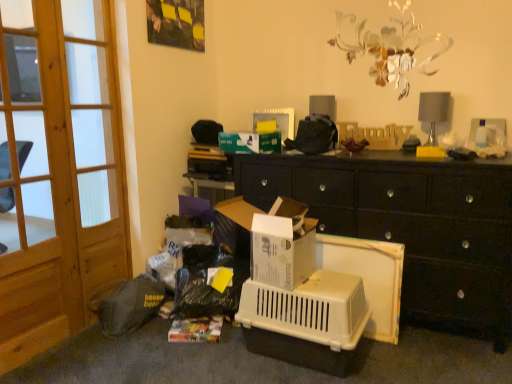
Question: Should I look upward or downward to see white plastic cabinet at center?

Choices:
 (A) down
 (B) up

Answer: (A)

Question: Considering the relative sizes of wooden screen door at left, which is the 1th screen door in left-to-right order, and wooden screen door at left, which is counted as the second screen door, starting from the left, in the image provided, is wooden screen door at left, which is the 1th screen door in left-to-right order, bigger than wooden screen door at left, which is counted as the second screen door, starting from the left,?

Choices:
 (A) yes
 (B) no

Answer: (A)

Question: Is wooden screen door at left, which ranks as the 2th screen door in right-to-left order, oriented away from wooden screen door at left, the first screen door positioned from the right?

Choices:
 (A) no
 (B) yes

Answer: (A)

Question: From the image's perspective, does wooden screen door at left, which ranks as the 2th screen door in right-to-left order, appear lower than wooden screen door at left, the first screen door positioned from the right?

Choices:
 (A) yes
 (B) no

Answer: (A)

Question: Is wooden screen door at left, which ranks as the 2th screen door in right-to-left order, at the right side of wooden screen door at left, which is counted as the second screen door, starting from the left?

Choices:
 (A) yes
 (B) no

Answer: (B)

Question: Does wooden screen door at left, which is the 1th screen door in left-to-right order, have a lesser width compared to wooden screen door at left, the first screen door positioned from the right?

Choices:
 (A) yes
 (B) no

Answer: (B)

Question: Considering the relative sizes of wooden screen door at left, which ranks as the 2th screen door in right-to-left order, and wooden screen door at left, which is counted as the second screen door, starting from the left, in the image provided, is wooden screen door at left, which ranks as the 2th screen door in right-to-left order, smaller than wooden screen door at left, which is counted as the second screen door, starting from the left,?

Choices:
 (A) yes
 (B) no

Answer: (B)

Question: Does white plastic cabinet at center appear on the right side of white cardboard box at center?

Choices:
 (A) no
 (B) yes

Answer: (B)

Question: From a real-world perspective, is white plastic cabinet at center on top of white cardboard box at center?

Choices:
 (A) yes
 (B) no

Answer: (B)

Question: Would you say white plastic cabinet at center is outside white cardboard box at center?

Choices:
 (A) yes
 (B) no

Answer: (A)

Question: Is white plastic cabinet at center placed right next to white cardboard box at center?

Choices:
 (A) yes
 (B) no

Answer: (B)

Question: Considering the relative sizes of white plastic cabinet at center and white cardboard box at center in the image provided, is white plastic cabinet at center taller than white cardboard box at center?

Choices:
 (A) yes
 (B) no

Answer: (A)

Question: From the image's perspective, is white plastic cabinet at center beneath white cardboard box at center?

Choices:
 (A) yes
 (B) no

Answer: (B)

Question: Is wooden screen door at left, the first screen door positioned from the right, facing away from white cardboard box at center?

Choices:
 (A) no
 (B) yes

Answer: (A)